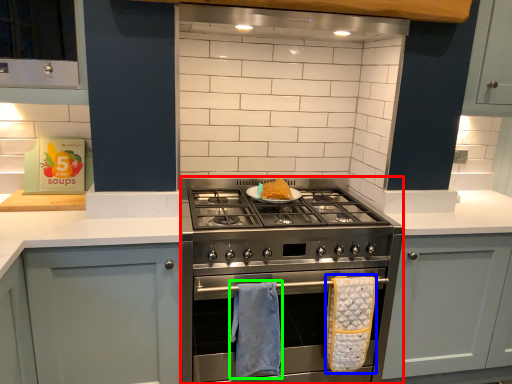
Question: Which object is positioned farthest from appliance (highlighted by a red box)? Select from bath towel (highlighted by a blue box) and bath towel (highlighted by a green box).

Choices:
 (A) bath towel
 (B) bath towel

Answer: (A)